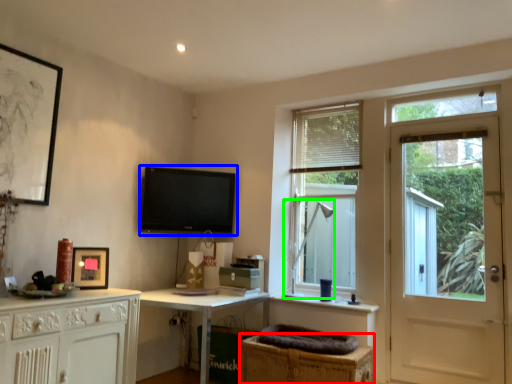
Question: Estimate the real-world distances between objects in this image. Which object is farther from cabinetry (highlighted by a red box), television (highlighted by a blue box) or table lamp (highlighted by a green box)?

Choices:
 (A) television
 (B) table lamp

Answer: (A)